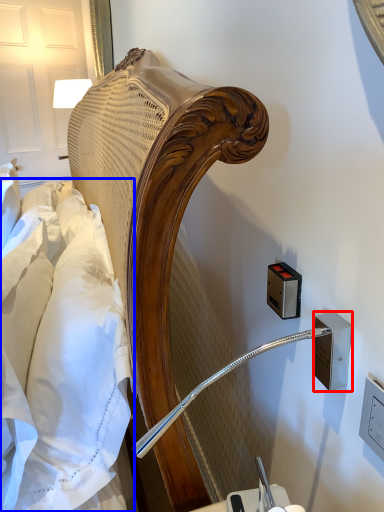
Question: Which object is further to the camera taking this photo, electric outlet (highlighted by a red box) or sheet (highlighted by a blue box)?

Choices:
 (A) electric outlet
 (B) sheet

Answer: (A)